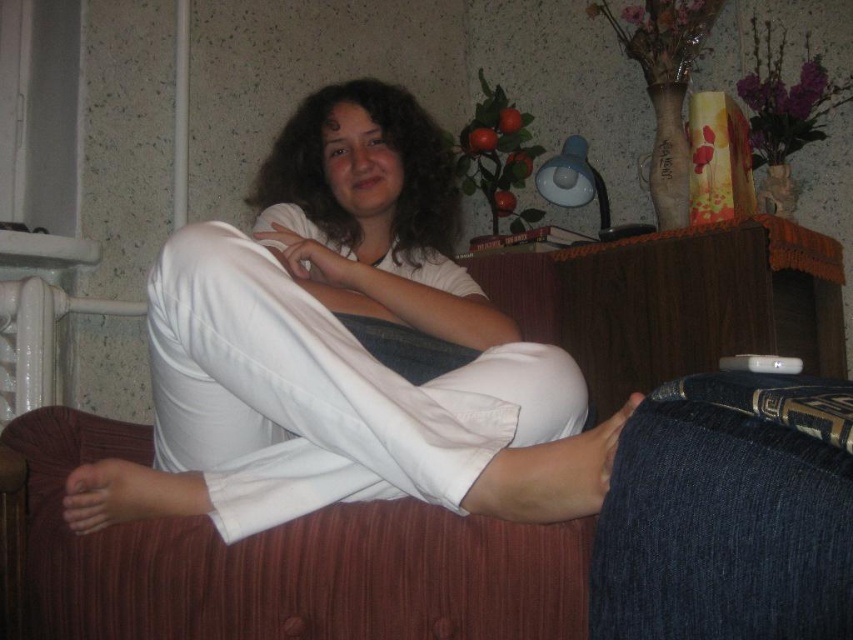
You are designing a layout for a living room and need to place the white cotton pants at center and the white plastic radiator at left. Given their sizes, which object should be placed closer to the entrance to ensure proper visibility?

The white cotton pants at center has a larger size compared to the white plastic radiator at left, so placing the white cotton pants at center closer to the entrance would ensure better visibility due to its larger size.